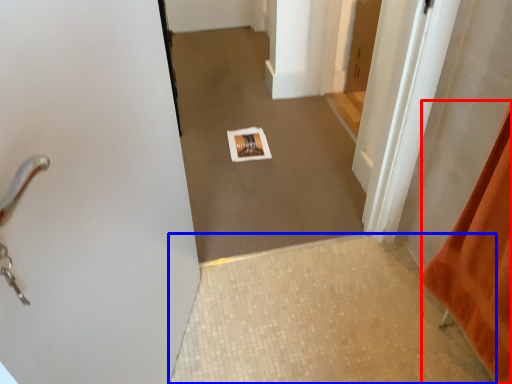
Question: Among these objects, which one is nearest to the camera, blanket (highlighted by a red box) or tile (highlighted by a blue box)?

Choices:
 (A) blanket
 (B) tile

Answer: (A)